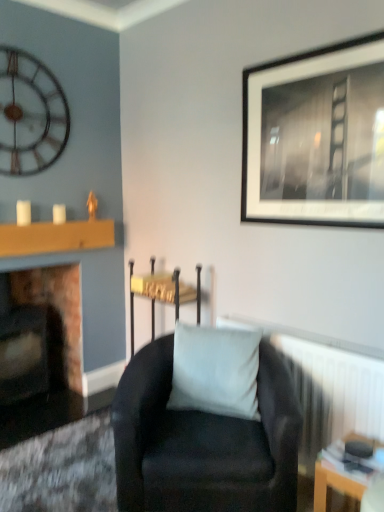
Measure the distance between point (335,125) and camera.

The depth of point (335,125) is 5.92 feet.

Identify the location of marble fireplace at left. Image resolution: width=384 pixels, height=512 pixels. (50, 353).

This screenshot has height=512, width=384. Describe the element at coordinates (50, 353) in the screenshot. I see `marble fireplace at left` at that location.

Locate an element on the screen. This screenshot has width=384, height=512. wooden table at lower right is located at coordinates (334, 484).

Considering the relative sizes of wooden mantle at left and velvet black armchair at center in the image provided, is wooden mantle at left smaller than velvet black armchair at center?

Yes.

Is wooden mantle at left oriented away from velvet black armchair at center?

No, velvet black armchair at center is not at the back of wooden mantle at left.

Considering the relative positions of wooden mantle at left and velvet black armchair at center in the image provided, is wooden mantle at left to the left of velvet black armchair at center from the viewer's perspective?

Yes, wooden mantle at left is to the left of velvet black armchair at center.

Is wooden mantle at left positioned far away from velvet black armchair at center?

No.

How many degrees apart are the facing directions of wooden table at lower right and velvet black armchair at center?

There is a 2.86-degree angle between the facing directions of wooden table at lower right and velvet black armchair at center.

Is wooden table at lower right touching velvet black armchair at center?

wooden table at lower right and velvet black armchair at center are not in contact.

Would you say wooden table at lower right is outside velvet black armchair at center?

Yes, wooden table at lower right is located beyond the bounds of velvet black armchair at center.

From a real-world perspective, is wooden table at lower right below velvet black armchair at center?

Yes, from a real-world perspective, wooden table at lower right is under velvet black armchair at center.

Is velvet black armchair at center far away from marble fireplace at left?

No, velvet black armchair at center is not far away from marble fireplace at left.

Consider the image. Between velvet black armchair at center and marble fireplace at left, which one is positioned in front?

Positioned in front is velvet black armchair at center.

Would you say velvet black armchair at center is to the left or to the right of marble fireplace at left in the picture?

velvet black armchair at center is positioned on marble fireplace at left's right side.

From the image's perspective, relative to marble fireplace at left, is velvet black armchair at center above or below?

velvet black armchair at center is situated higher than marble fireplace at left in the image.

Which of these two, velvet black armchair at center or white textured radiator at lower right, is smaller?

velvet black armchair at center.

Consider the image. From the image's perspective, is velvet black armchair at center over white textured radiator at lower right?

Yes, from the image's perspective, velvet black armchair at center is over white textured radiator at lower right.

Is point (147, 293) closer or farther from the camera than point (311, 415)?

Point (147, 293) is farther from the camera than point (311, 415).

Is white textured radiator at lower right at the back of velvet black armchair at center?

That's not correct — velvet black armchair at center is not looking away from white textured radiator at lower right.

Is suede black armchair at center positioned beyond the bounds of wooden table at lower right?

suede black armchair at center lies outside wooden table at lower right's area.

From a real-world perspective, between suede black armchair at center and wooden table at lower right, who is vertically lower?

wooden table at lower right, from a real-world perspective.

Are suede black armchair at center and wooden table at lower right making contact?

No, suede black armchair at center is not with wooden table at lower right.

Which point is more distant from viewer, (197, 294) or (45, 239)?

Positioned behind is point (45, 239).

Can you confirm if velvet black armchair at center is smaller than wooden mantle at left?

No.

Is wooden mantle at left inside velvet black armchair at center?

No, wooden mantle at left is not inside velvet black armchair at center.

Is velvet black armchair at center positioned far away from wooden mantle at left?

No, velvet black armchair at center is in close proximity to wooden mantle at left.

Does velvet black armchair at center turn towards wooden table at lower right?

No, velvet black armchair at center does not turn towards wooden table at lower right.

Which of these two, velvet black armchair at center or wooden table at lower right, stands shorter?

With less height is wooden table at lower right.

From a real-world perspective, which is physically above, velvet black armchair at center or wooden table at lower right?

velvet black armchair at center, from a real-world perspective.

Does velvet black armchair at center lie in front of wooden table at lower right?

That is False.

You are a GUI agent. You are given a task and a screenshot of the screen. Output one action in this format:
    pyautogui.click(x=<x>, y=<y>)
    Task: Click on the armchair in front of the wooden mantle at left
    
    Given the screenshot: What is the action you would take?
    pyautogui.click(x=162, y=293)

The height and width of the screenshot is (512, 384). I want to click on table located on the right of velvet black armchair at center, so click(334, 484).

Based on their spatial positions, is velvet black armchair at center or marble fireplace at left further from black matte picture frame at upper right?

marble fireplace at left.

Considering their positions, is velvet black armchair at center positioned closer to black matte picture frame at upper right than wooden mantle at left?

Based on the image, velvet black armchair at center appears to be nearer to black matte picture frame at upper right.

Considering their positions, is black matte picture frame at upper right positioned further to wooden table at lower right than velvet black armchair at center?

black matte picture frame at upper right lies further to wooden table at lower right than the other object.

Which object lies further to the anchor point wooden table at lower right, velvet black armchair at center or wooden mantle at left?

The object further to wooden table at lower right is wooden mantle at left.

From the image, which object appears to be nearer to metallic wall clock at upper left, marble fireplace at left or wooden table at lower right?

marble fireplace at left.

Based on their spatial positions, is marble fireplace at left or white textured radiator at lower right further from velvet black armchair at center?

Based on the image, white textured radiator at lower right appears to be further to velvet black armchair at center.

Consider the image. Based on their spatial positions, is suede black armchair at center or white matte pillow at center closer to wooden mantle at left?

white matte pillow at center is positioned closer to the anchor wooden mantle at left.

Looking at the image, which one is located further to black matte picture frame at upper right, velvet black armchair at center or wooden table at lower right?

wooden table at lower right.

The height and width of the screenshot is (512, 384). What are the coordinates of `pillow between wooden table at lower right and velvet black armchair at center in the front-back direction` in the screenshot? It's located at (215, 370).

At what (x,y) coordinates should I click in order to perform the action: click on mantle between metallic wall clock at upper left and suede black armchair at center in the up-down direction. Please return your answer as a coordinate pair (x, y). The width and height of the screenshot is (384, 512). Looking at the image, I should click on (55, 237).

What are the coordinates of `fireplace between metallic wall clock at upper left and white matte pillow at center in the up-down direction` in the screenshot? It's located at (50, 353).

You are a GUI agent. You are given a task and a screenshot of the screen. Output one action in this format:
    pyautogui.click(x=<x>, y=<y>)
    Task: Click on the picture frame between metallic wall clock at upper left and suede black armchair at center from top to bottom
    This screenshot has width=384, height=512.
    Given the screenshot: What is the action you would take?
    pyautogui.click(x=316, y=137)